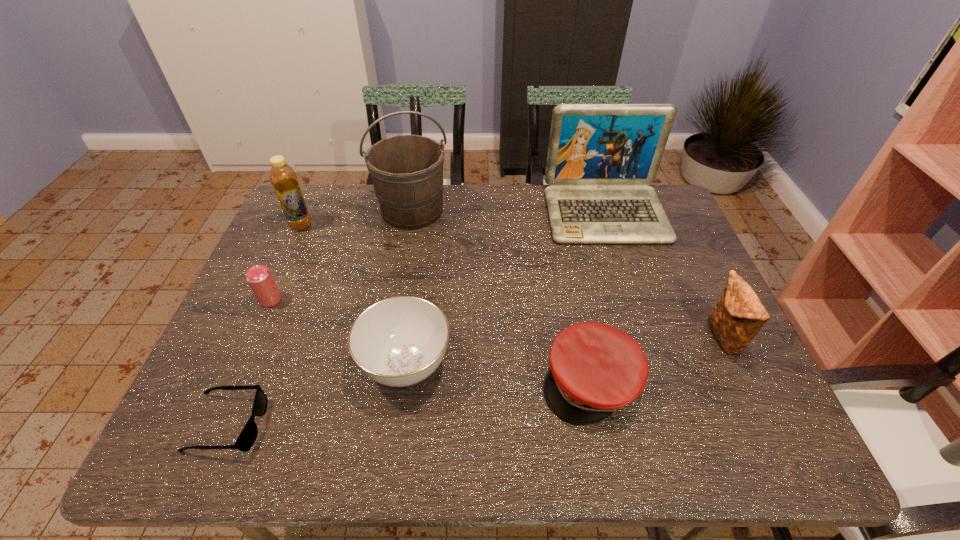
The height and width of the screenshot is (540, 960). I want to click on object that is at the far right corner, so (x=601, y=157).

The height and width of the screenshot is (540, 960). In the image, there is a desktop. Identify the location of blank space at the far edge. (451, 203).

Locate an element on the screen. The height and width of the screenshot is (540, 960). vacant space at the near edge is located at coordinates (317, 461).

The width and height of the screenshot is (960, 540). In the image, there is a desktop. Find the location of `blank space at the left edge`. blank space at the left edge is located at coordinates (213, 386).

In the image, there is a desktop. Where is `vacant space at the right edge`? The width and height of the screenshot is (960, 540). vacant space at the right edge is located at coordinates (742, 357).

Locate an element on the screen. blank area at the near right corner is located at coordinates (742, 450).

Locate an element on the screen. free spot between the shortest object and the bottle is located at coordinates (264, 325).

Find the location of `unoccupied position between the second tallest object and the cap`. unoccupied position between the second tallest object and the cap is located at coordinates (598, 298).

I want to click on free space between the sunglasses and the cap, so (409, 403).

Where is `free space between the laptop computer and the beer can`? Image resolution: width=960 pixels, height=540 pixels. free space between the laptop computer and the beer can is located at coordinates (438, 257).